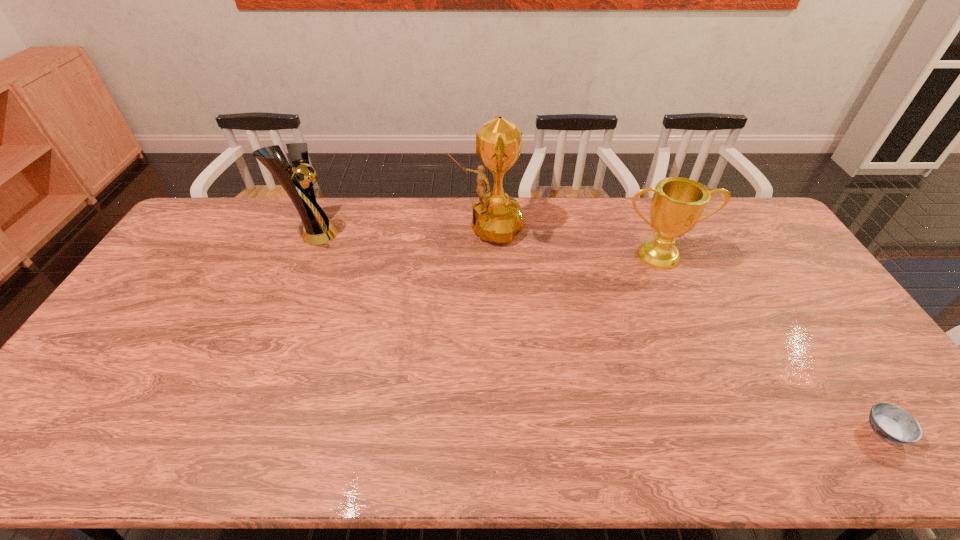
Choose which object is the third nearest neighbor to the rightmost object. Please provide its 2D coordinates. Your answer should be formatted as a tuple, i.e. [(x, y)], where the tuple contains the x and y coordinates of a point satisfying the conditions above.

[(318, 229)]

Identify which object is located as the nearest to the second shortest object. Please provide its 2D coordinates. Your answer should be formatted as a tuple, i.e. [(x, y)], where the tuple contains the x and y coordinates of a point satisfying the conditions above.

[(496, 217)]

Locate an element on the screen. The height and width of the screenshot is (540, 960). the closest award relative to the second object from left to right is located at coordinates (677, 204).

I want to click on award that is the second nearest to the leftmost object, so click(x=677, y=204).

Find the location of a particular element. vacant space that satisfies the following two spatial constraints: 1. on the shiny surface of the nearest object; 2. on the right side of the rightmost award is located at coordinates (735, 431).

Find the location of a particular element. The image size is (960, 540). vacant space that satisfies the following two spatial constraints: 1. on the back side of the rightmost object; 2. at the front of the leftmost award, where the globe is visible is located at coordinates (751, 233).

This screenshot has height=540, width=960. Identify the location of vacant region that satisfies the following two spatial constraints: 1. on the front side of the second award from left to right; 2. on the right side of the shortest object. (490, 431).

In order to click on vacant area in the image that satisfies the following two spatial constraints: 1. at the front of the nearest object, where the globe is visible; 2. on the right side of the leftmost award in this screenshot , I will do `click(230, 431)`.

You are a GUI agent. You are given a task and a screenshot of the screen. Output one action in this format:
    pyautogui.click(x=<x>, y=<y>)
    Task: Click on the vacant position in the image that satisfies the following two spatial constraints: 1. at the front of the leftmost object, where the globe is visible; 2. on the back side of the rightmost object
    The width and height of the screenshot is (960, 540).
    Given the screenshot: What is the action you would take?
    pyautogui.click(x=230, y=431)

The width and height of the screenshot is (960, 540). Identify the location of free location that satisfies the following two spatial constraints: 1. on the front side of the second award from right to left; 2. on the right side of the shortest object. (490, 431).